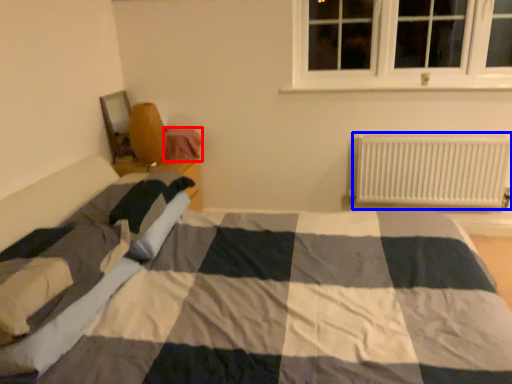
Question: Among these objects, which one is nearest to the camera, material (highlighted by a red box) or radiator (highlighted by a blue box)?

Choices:
 (A) material
 (B) radiator

Answer: (B)